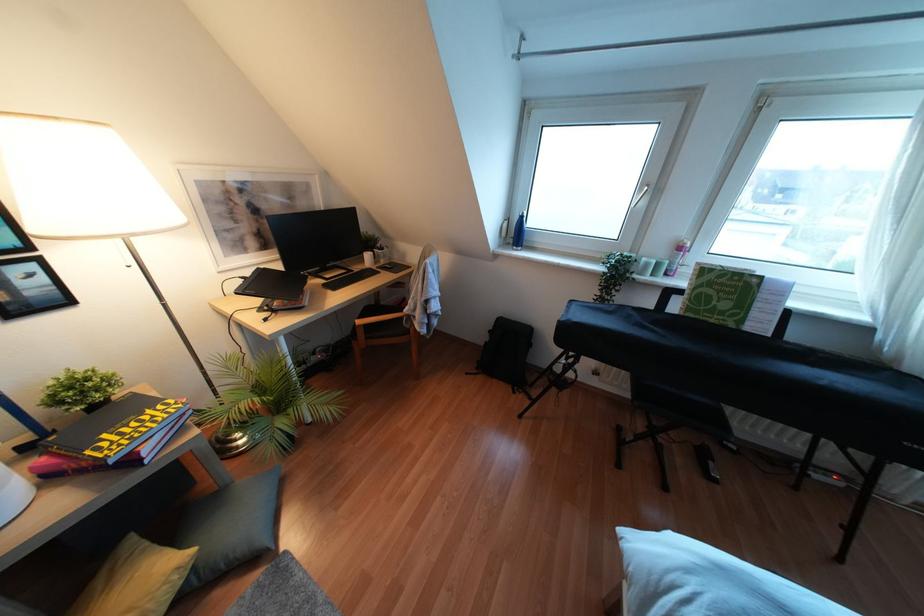
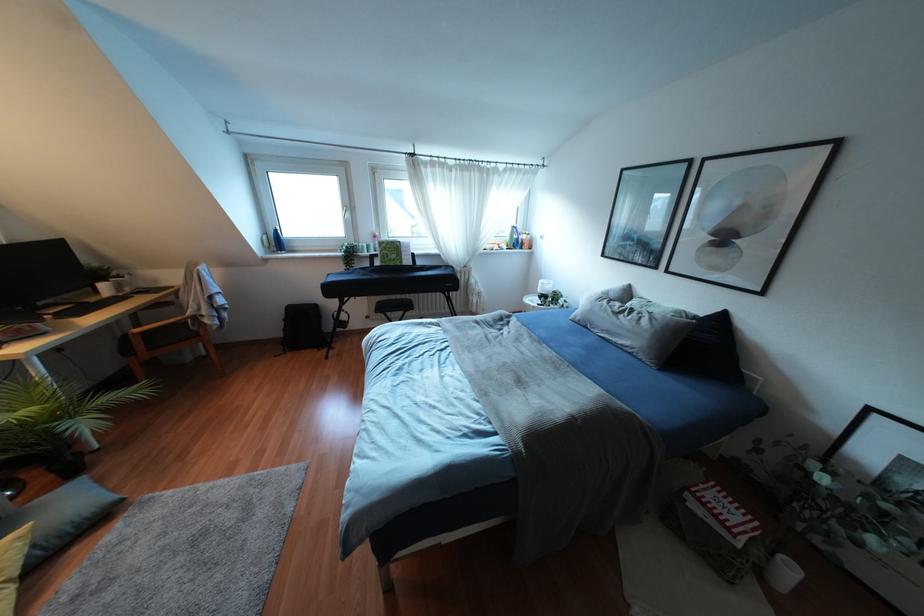
Where in the second image is the point corresponding to [708,296] from the first image?

(385, 254)